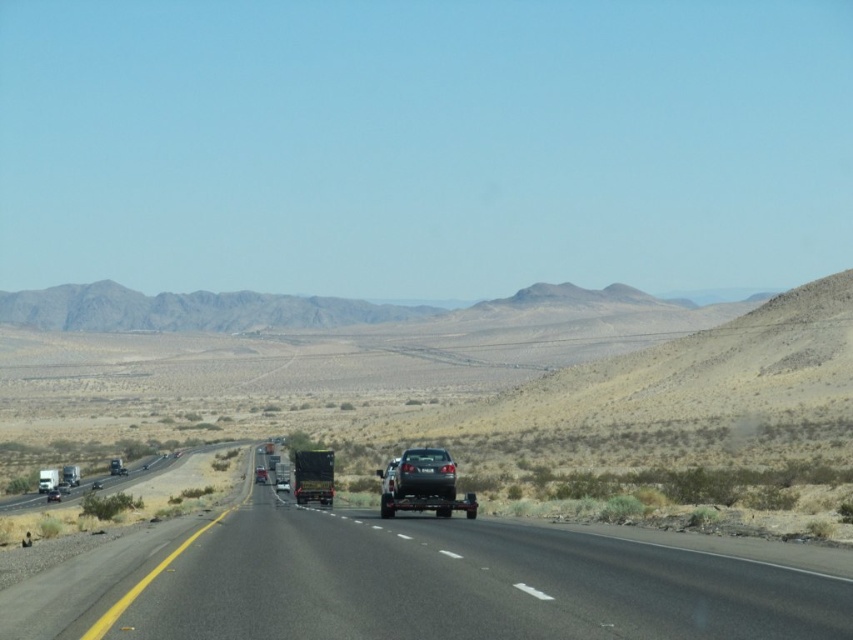
Does point (306, 464) come behind point (254, 474)?

No, it is in front of (254, 474).

Is green matte trailer truck at center above glossy black truck at center?

Yes, green matte trailer truck at center is above glossy black truck at center.

Image resolution: width=853 pixels, height=640 pixels. What do you see at coordinates (312, 476) in the screenshot?
I see `green matte trailer truck at center` at bounding box center [312, 476].

Locate an element on the screen. The width and height of the screenshot is (853, 640). green matte trailer truck at center is located at coordinates (312, 476).

Which is more to the left, black metallic truck at center or green matte trailer truck at center?

From the viewer's perspective, green matte trailer truck at center appears more on the left side.

Locate an element on the screen. This screenshot has width=853, height=640. black metallic truck at center is located at coordinates (413, 582).

At what (x,y) coordinates should I click in order to perform the action: click on black metallic truck at center. Please return your answer as a coordinate pair (x, y). The image size is (853, 640). Looking at the image, I should click on (413, 582).

Is point (421, 477) less distant than point (54, 488)?

Yes.

Does shiny silver car at center have a lesser width compared to matte black truck at center?

Yes, shiny silver car at center is thinner than matte black truck at center.

I want to click on shiny silver car at center, so click(x=422, y=484).